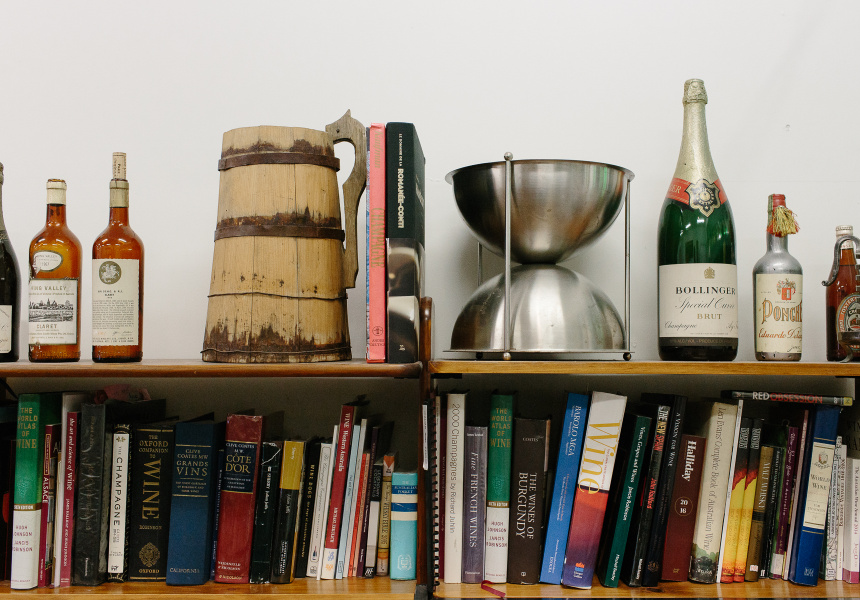
Image resolution: width=860 pixels, height=600 pixels. In order to click on white wall in this screenshot , I will do `click(554, 80)`.